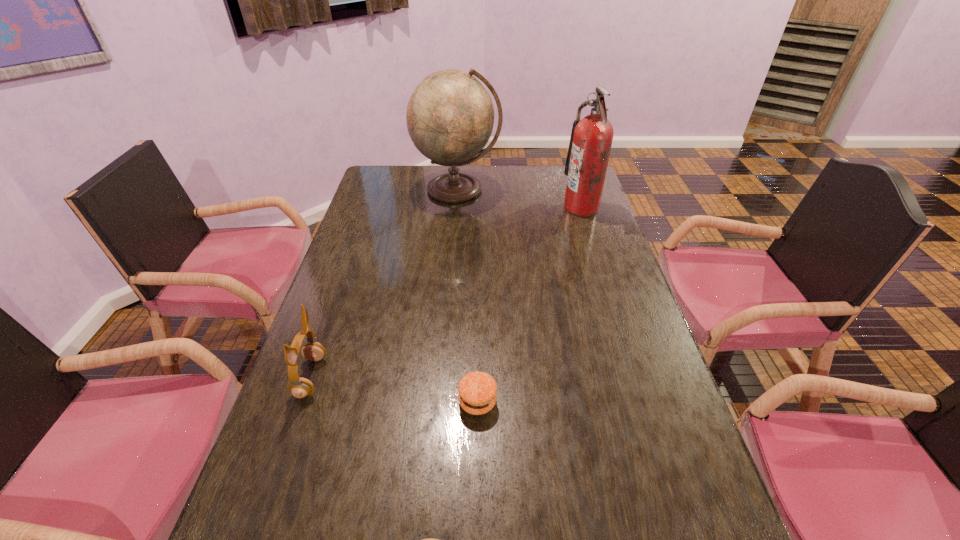
Where is `free space that satisfies the following two spatial constraints: 1. on the front-facing side of the leftmost object; 2. on the left side of the second shortest object`? The width and height of the screenshot is (960, 540). free space that satisfies the following two spatial constraints: 1. on the front-facing side of the leftmost object; 2. on the left side of the second shortest object is located at coordinates (302, 402).

Image resolution: width=960 pixels, height=540 pixels. I want to click on free location that satisfies the following two spatial constraints: 1. on the front-facing side of the farther patty; 2. on the right side of the leftmost object, so click(302, 402).

Find the location of `free space that satisfies the following two spatial constraints: 1. on the front-facing side of the globe; 2. on the front-facing side of the earphone`. free space that satisfies the following two spatial constraints: 1. on the front-facing side of the globe; 2. on the front-facing side of the earphone is located at coordinates (443, 377).

Identify the location of vacant region that satisfies the following two spatial constraints: 1. on the front-facing side of the globe; 2. on the front-facing side of the third shortest object. (x=443, y=377).